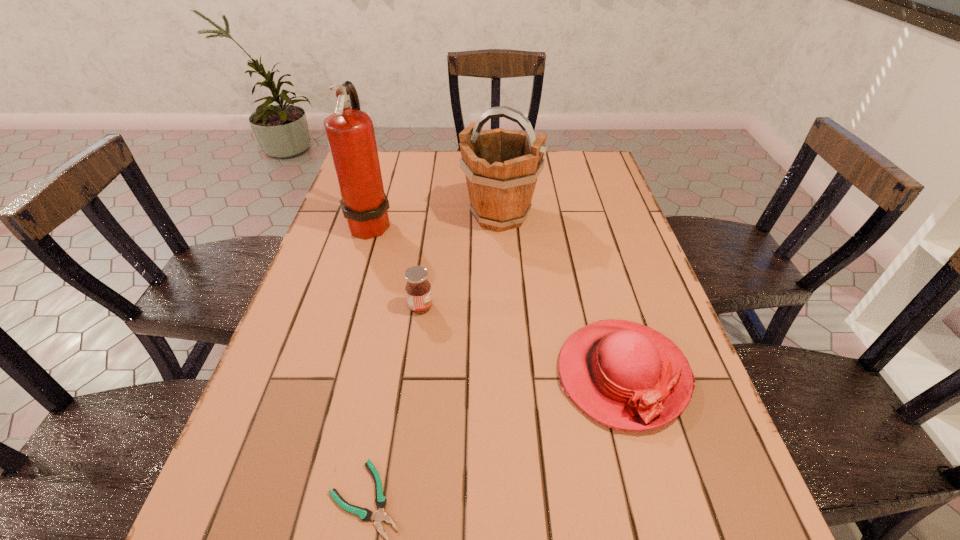
Where is `the tallest object`? The height and width of the screenshot is (540, 960). the tallest object is located at coordinates (350, 133).

Where is `fire extinguisher`? fire extinguisher is located at coordinates (350, 133).

The width and height of the screenshot is (960, 540). Find the location of `the second tallest object`. the second tallest object is located at coordinates tap(501, 167).

Find the location of a particular element. Image resolution: width=960 pixels, height=540 pixels. jam is located at coordinates (418, 288).

Identify the location of hat. (627, 376).

Locate an element on the screen. vacant space located at the nozzle of the fire extinguisher is located at coordinates (519, 224).

You are a GUI agent. You are given a task and a screenshot of the screen. Output one action in this format:
    pyautogui.click(x=<x>, y=<y>)
    Task: Click on the free space located on the front of the bucket
    The width and height of the screenshot is (960, 540).
    Given the screenshot: What is the action you would take?
    [505, 296]

Identify the location of vacant point located on the label side of the third nearest object. (493, 307).

Where is `blank space located at the front of the second nearest object with a bow`? The width and height of the screenshot is (960, 540). blank space located at the front of the second nearest object with a bow is located at coordinates tap(666, 534).

This screenshot has width=960, height=540. Identify the location of object that is at the left edge. (350, 133).